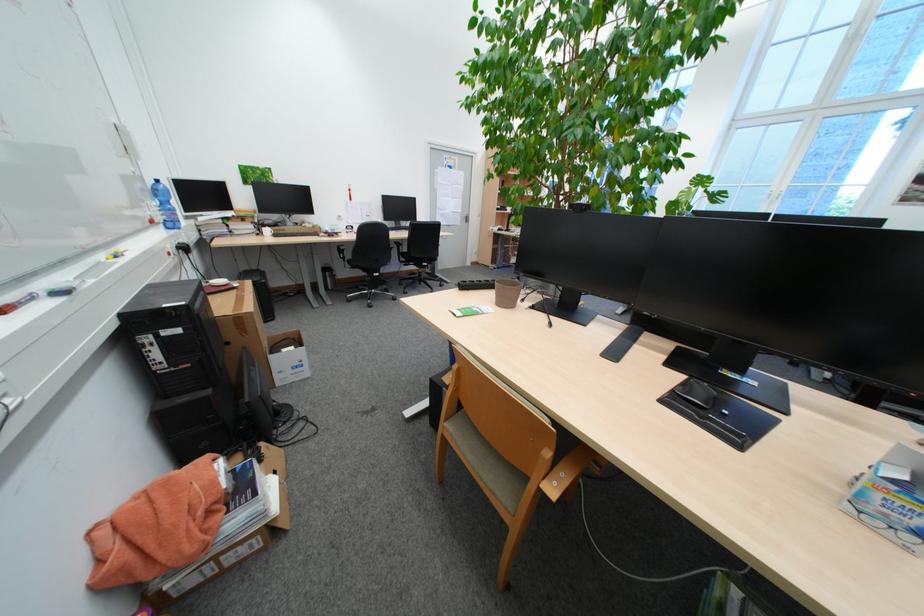
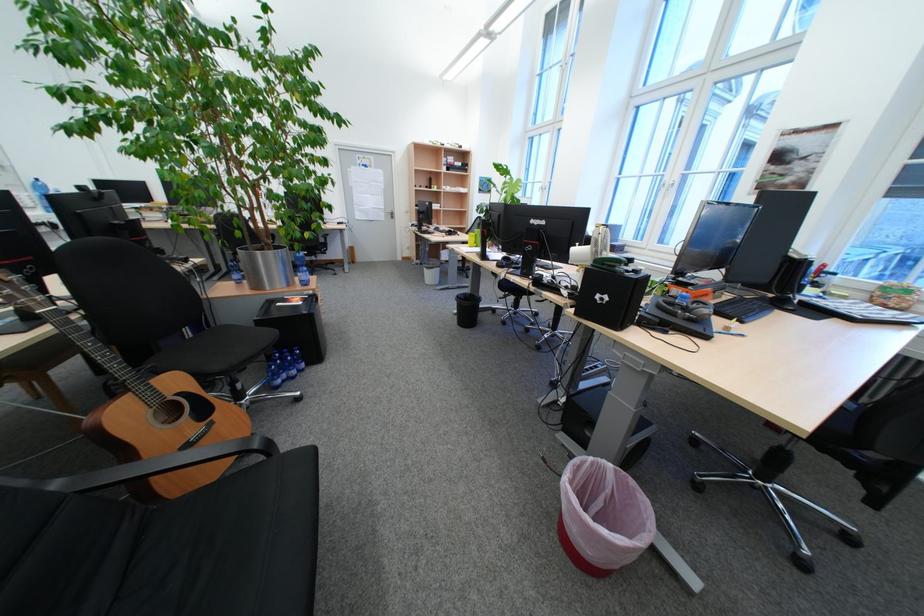
In the second image, find the point that corresponds to (x=468, y=222) in the first image.

(394, 217)